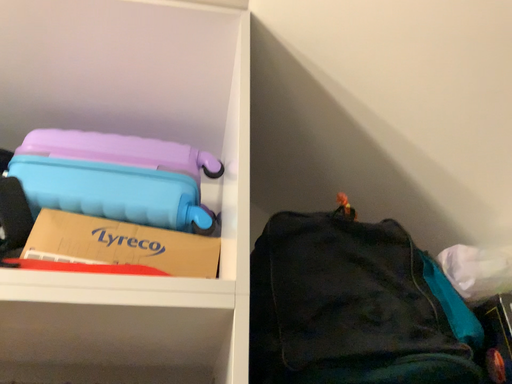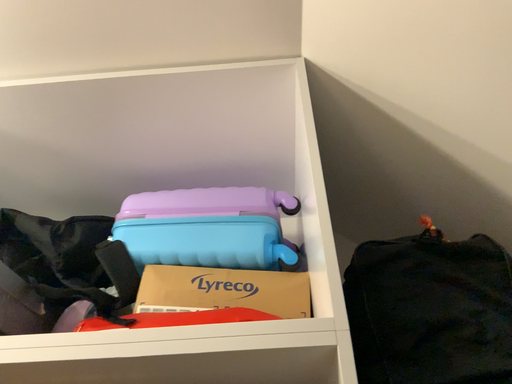
Question: Which way did the camera rotate in the video?

Choices:
 (A) rotated left
 (B) rotated right

Answer: (A)